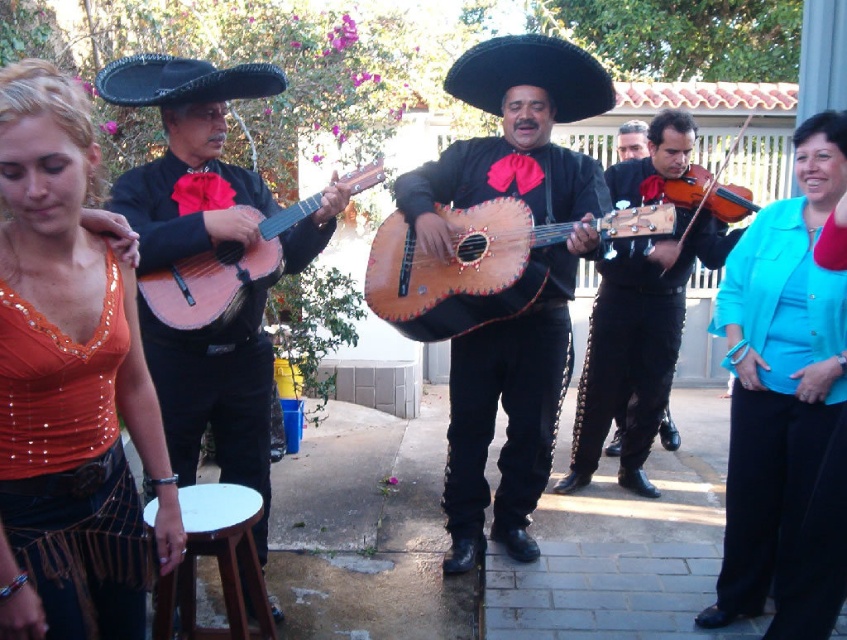
You are standing at the edge of the courtyard and want to hand a flower to the musician holding the matte black guitar at center. If you can reach up to 3 meters, will you be able to reach them?

The matte black guitar at center is 3.17 meters away from the viewer. Since your reach is up to 3 meters, you cannot reach the musician holding the matte black guitar at center as they are slightly farther than your maximum reach.